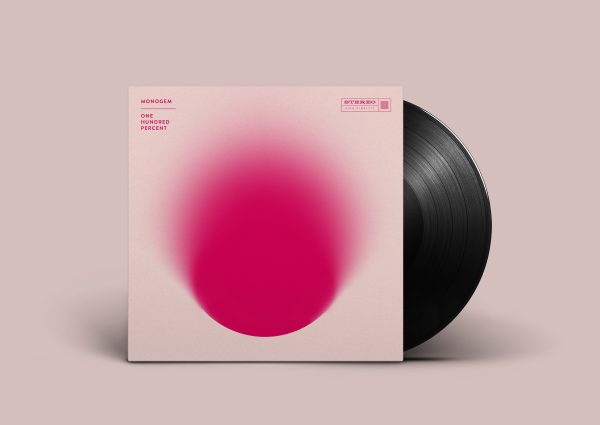
Find the location of `pink box with word stereo written inside`. pink box with word stereo written inside is located at coordinates (367, 104).